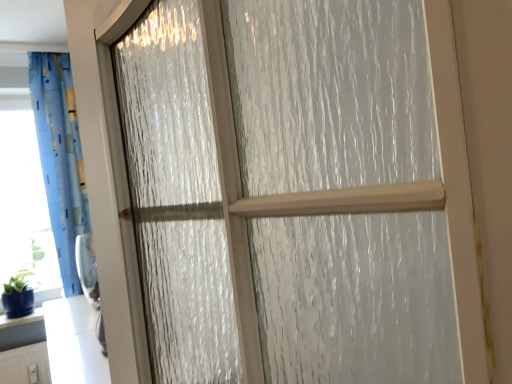
Question: In the image, is blue glossy vase at lower left positioned in front of or behind blue fabric curtain at left?

Choices:
 (A) behind
 (B) front

Answer: (A)

Question: From a real-world perspective, is blue glossy vase at lower left positioned above or below blue fabric curtain at left?

Choices:
 (A) below
 (B) above

Answer: (A)

Question: Which is nearer to the blue glossy vase at lower left?

Choices:
 (A) blue fabric curtain at left
 (B) transparent plastic window screen at left

Answer: (B)

Question: Based on their relative distances, which object is farther from the blue fabric curtain at left?

Choices:
 (A) transparent plastic window screen at left
 (B) blue glossy vase at lower left

Answer: (B)